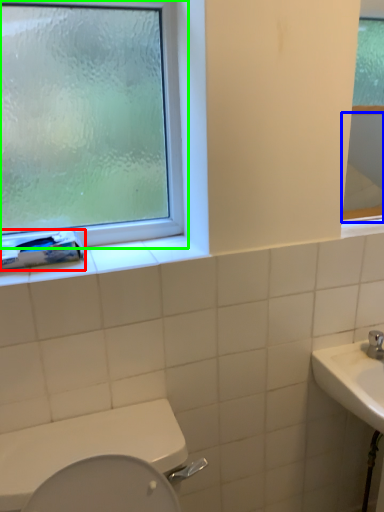
Question: Estimate the real-world distances between objects in this image. Which object is closer to toilet paper (highlighted by a red box), mirror (highlighted by a blue box) or window (highlighted by a green box)?

Choices:
 (A) mirror
 (B) window

Answer: (B)